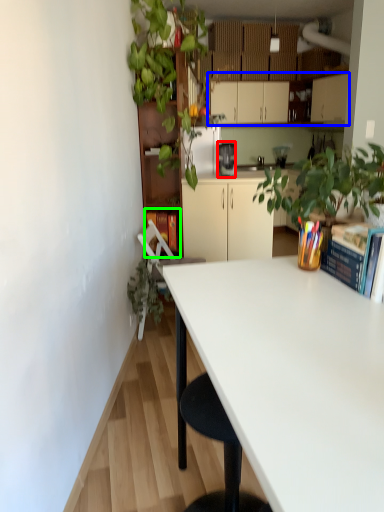
Question: Estimate the real-world distances between objects in this image. Which object is closer to coffee maker (highlighted by a red box), cabinetry (highlighted by a blue box) or book (highlighted by a green box)?

Choices:
 (A) cabinetry
 (B) book

Answer: (B)